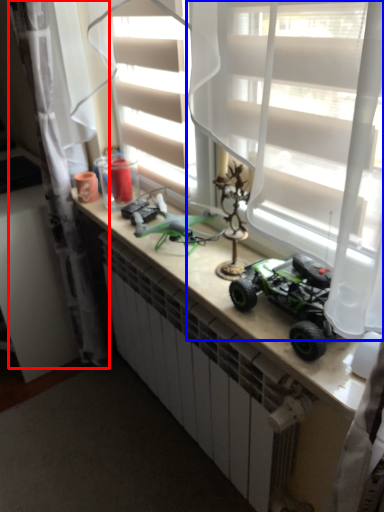
Question: Which of the following is the closest to the observer, curtain (highlighted by a red box) or curtain (highlighted by a blue box)?

Choices:
 (A) curtain
 (B) curtain

Answer: (B)